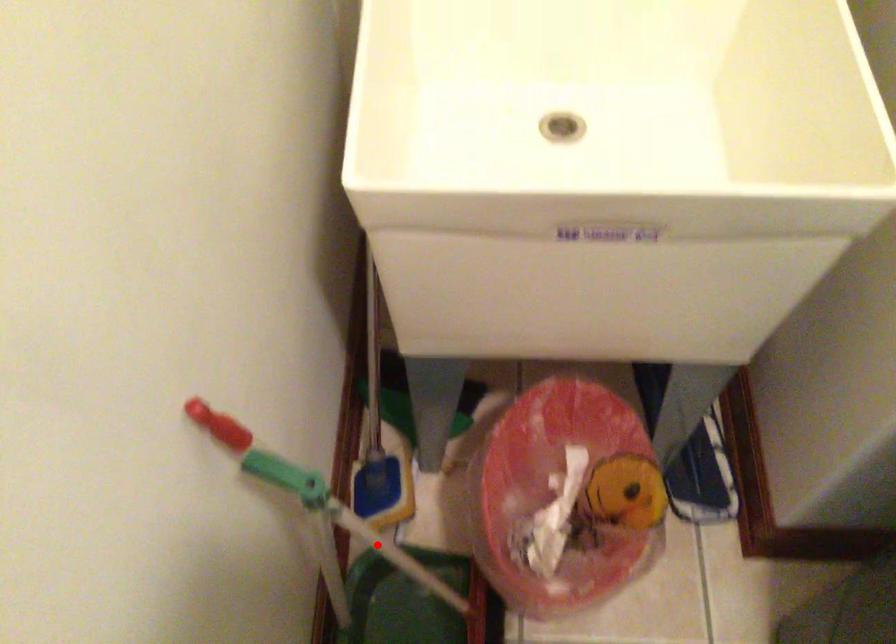
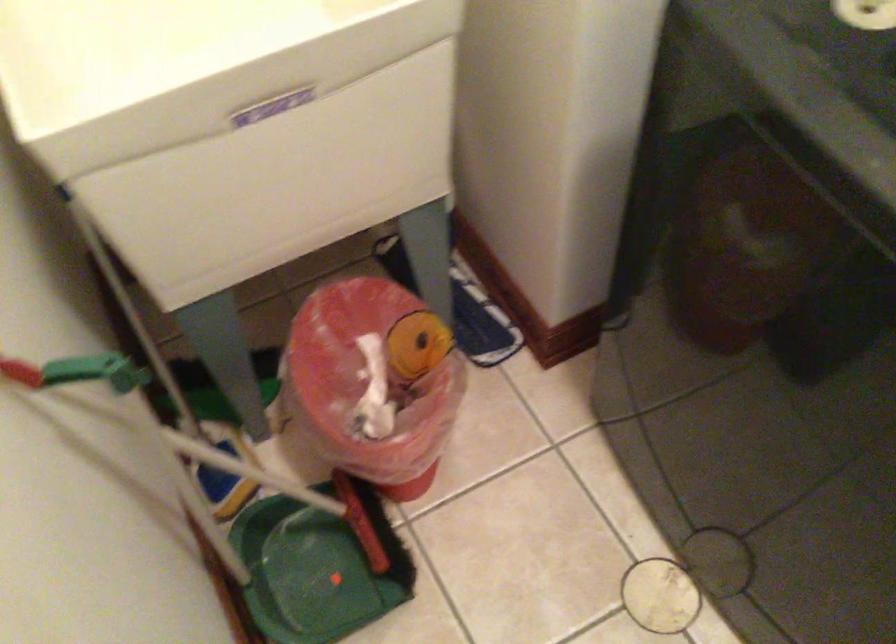
The point at the highlighted location is marked in the first image. Where is the corresponding point in the second image?

(228, 462)